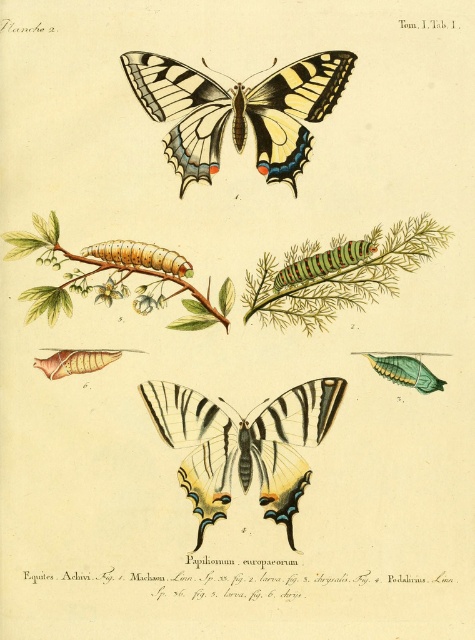
Question: Which object appears farthest from the camera in this image?

Choices:
 (A) green leafy branch at center-left
 (B) matte black butterfly at center
 (C) brown fuzzy caterpillar at upper left
 (D) green feathery stem at center

Answer: (C)

Question: Which object appears farthest from the camera in this image?

Choices:
 (A) brown fuzzy caterpillar at upper left
 (B) matte black butterfly at upper center
 (C) green leafy branch at center-left

Answer: (A)

Question: Among these objects, which one is farthest from the camera?

Choices:
 (A) green feathery stem at center
 (B) multicolored fuzzy caterpillar at center

Answer: (B)

Question: Does matte black butterfly at center have a smaller size compared to multicolored fuzzy caterpillar at center?

Choices:
 (A) no
 (B) yes

Answer: (A)

Question: Is the position of matte black butterfly at upper center less distant than that of multicolored fuzzy caterpillar at center?

Choices:
 (A) no
 (B) yes

Answer: (B)

Question: Can you confirm if green feathery stem at center is smaller than brown fuzzy caterpillar at upper left?

Choices:
 (A) yes
 (B) no

Answer: (B)